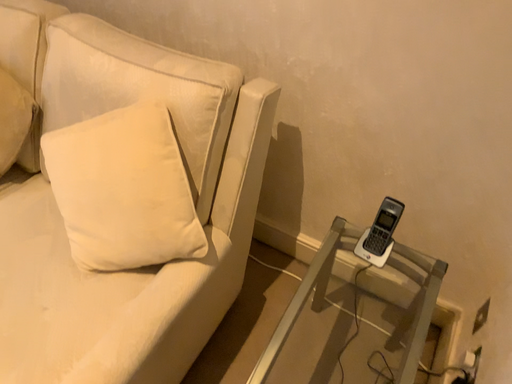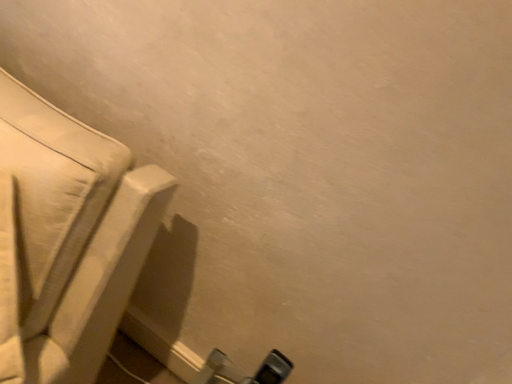
Question: How did the camera likely rotate when shooting the video?

Choices:
 (A) rotated left
 (B) rotated right

Answer: (B)